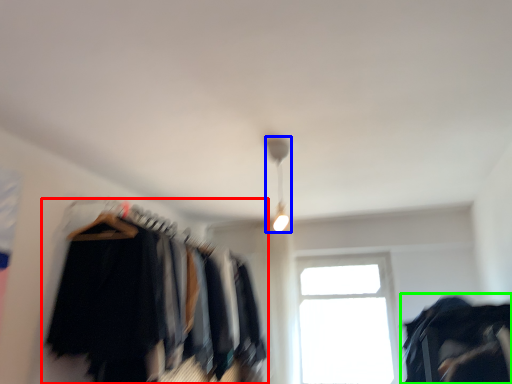
Question: Considering the real-world distances, which object is farthest from closet (highlighted by a red box)? lamp (highlighted by a blue box) or clothing (highlighted by a green box)?

Choices:
 (A) lamp
 (B) clothing

Answer: (B)